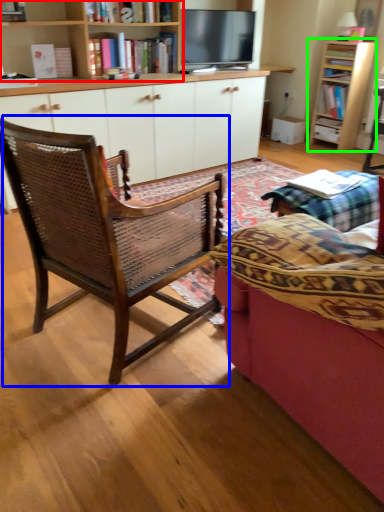
Question: Which object is positioned closest to bookcase (highlighted by a red box)? Select from chair (highlighted by a blue box) and bookcase (highlighted by a green box).

Choices:
 (A) chair
 (B) bookcase

Answer: (A)